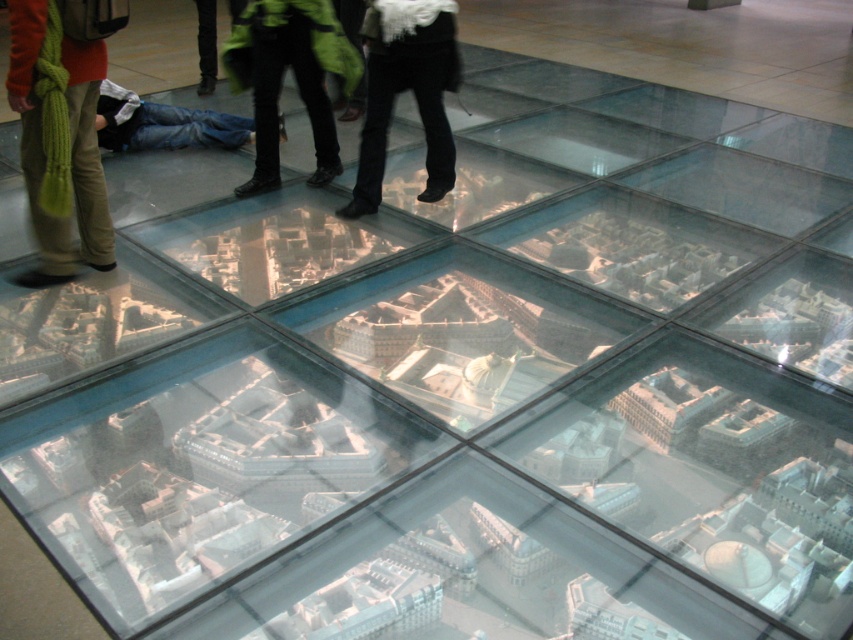
You are a GUI agent. You are given a task and a screenshot of the screen. Output one action in this format:
    pyautogui.click(x=<x>, y=<y>)
    Task: Click on the knitted green scarf at left
    The height and width of the screenshot is (640, 853).
    Given the screenshot: What is the action you would take?
    pyautogui.click(x=57, y=141)

Describe the element at coordinates (57, 141) in the screenshot. Image resolution: width=853 pixels, height=640 pixels. I see `knitted green scarf at left` at that location.

This screenshot has height=640, width=853. In order to click on knitted green scarf at left in this screenshot , I will do `click(57, 141)`.

Measure the distance from knitted green scarf at left to green matte jacket at upper center.

A distance of 6.53 feet exists between knitted green scarf at left and green matte jacket at upper center.

In the scene shown: Does knitted green scarf at left have a greater height compared to green matte jacket at upper center?

Indeed, knitted green scarf at left has a greater height compared to green matte jacket at upper center.

The height and width of the screenshot is (640, 853). What are the coordinates of `knitted green scarf at left` in the screenshot? It's located at (57, 141).

In the scene shown: Can you confirm if knitted green scarf at left is bigger than black jeans at center?

Incorrect, knitted green scarf at left is not larger than black jeans at center.

What are the coordinates of `knitted green scarf at left` in the screenshot? It's located at (57, 141).